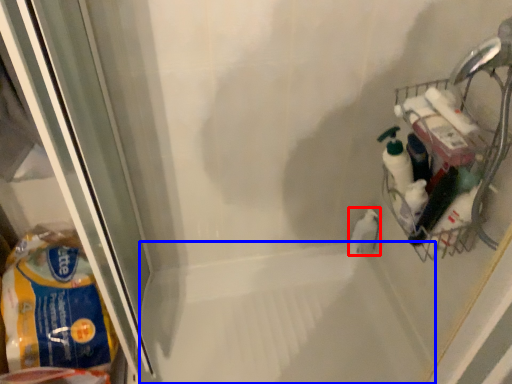
Question: Among these objects, which one is nearest to the camera, cleaning product (highlighted by a red box) or bath (highlighted by a blue box)?

Choices:
 (A) cleaning product
 (B) bath

Answer: (B)